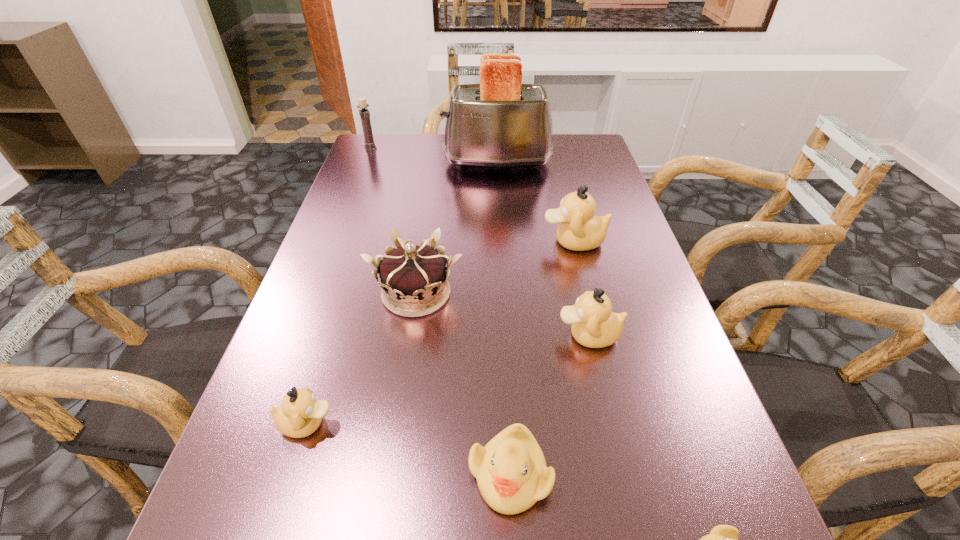
Find the location of a particular element. the third closest tan duckling to the nearer yellow duckling is located at coordinates (579, 230).

Find the location of `vacant space that satisfies the following two spatial constraints: 1. on the face of the second biggest tan duckling; 2. at the face of the bigger yellow duckling`. vacant space that satisfies the following two spatial constraints: 1. on the face of the second biggest tan duckling; 2. at the face of the bigger yellow duckling is located at coordinates (620, 474).

In order to click on free location that satisfies the following two spatial constraints: 1. on the face of the second smallest tan duckling; 2. at the face of the farther yellow duckling in this screenshot , I will do `click(620, 474)`.